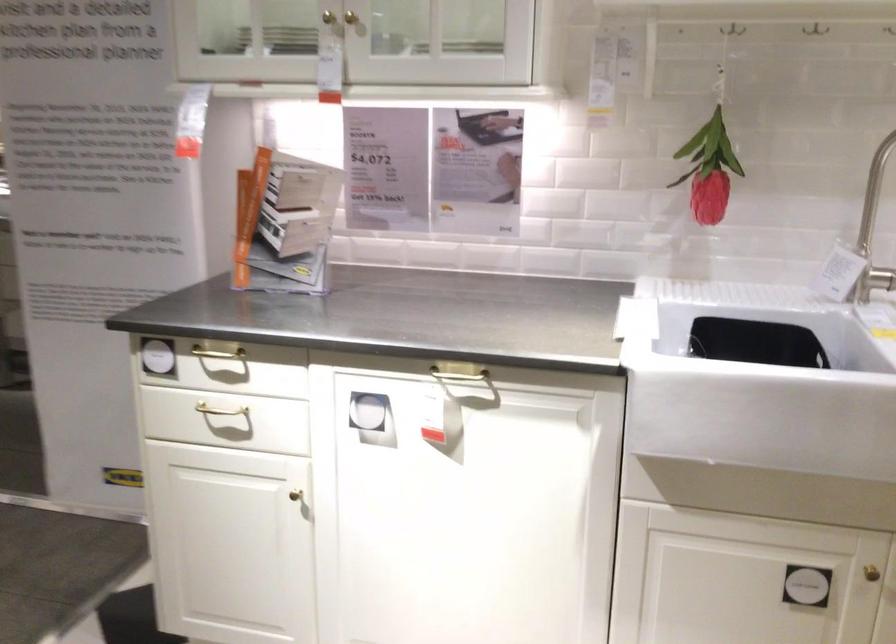
Find the location of a particular element. c is located at coordinates (880, 278).